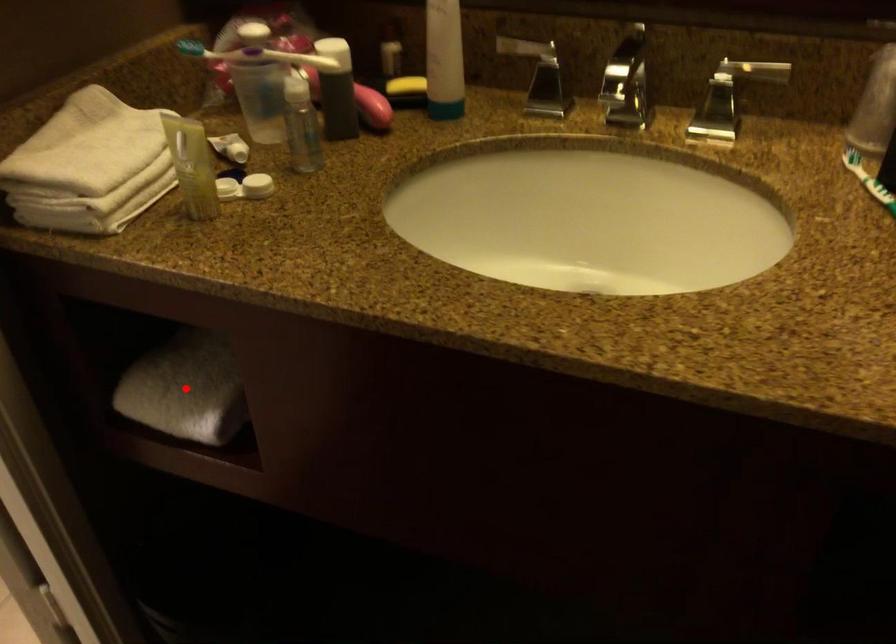
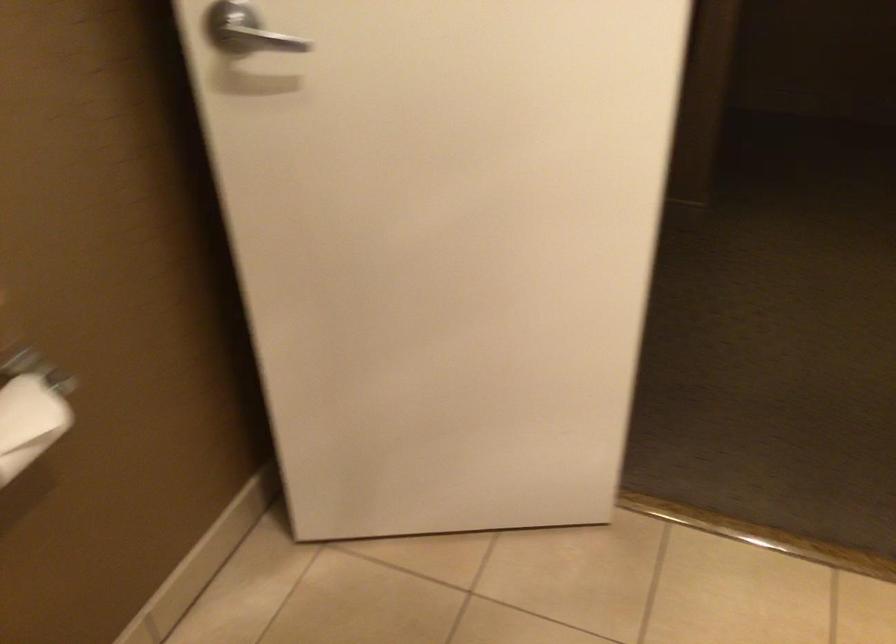
Question: I am providing you with two images of the same scene from different viewpoints. A red point is marked on the first image. At the location where the point appears in image 1, is it still visible in image 2?

Choices:
 (A) Yes
 (B) No

Answer: (B)